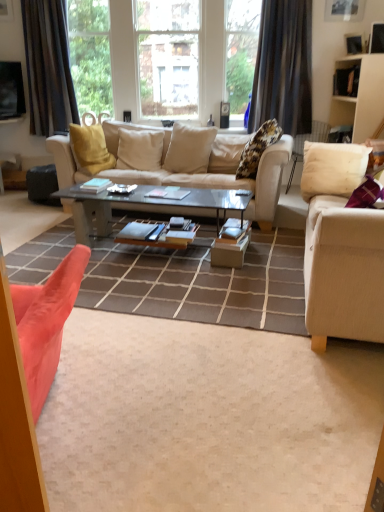
Question: In terms of width, does beige fabric pillow at center, which ranks as the second pillow in left-to-right order, look wider or thinner when compared to velvet orange armchair at center?

Choices:
 (A) wide
 (B) thin

Answer: (A)

Question: In the image, is beige fabric pillow at center, which is the third pillow from right to left, on the left side or the right side of velvet orange armchair at center?

Choices:
 (A) left
 (B) right

Answer: (B)

Question: Considering the real-world distances, which object is closest to the velvet orange armchair at center?

Choices:
 (A) white matte cabinet at upper right
 (B) beige fabric studio couch at right, placed as the second studio couch when sorted from left to right
 (C) beige fabric pillow at center, which is the third pillow from right to left
 (D) beige fabric couch at center, the 1th studio couch from the left
 (E) velvet pink armchair at lower left

Answer: (C)

Question: Estimate the real-world distances between objects in this image. Which object is closer to the velvet orange armchair at center?

Choices:
 (A) glass/metallic coffee table at center
 (B) beige fabric pillow at center, which ranks as the second pillow in left-to-right order
 (C) beige fabric couch at center, the 1th studio couch from the left
 (D) fluffy beige pillow at upper center, the third pillow viewed from the left
 (E) black fabric curtain at upper right, positioned as the second curtain in left-to-right order

Answer: (B)